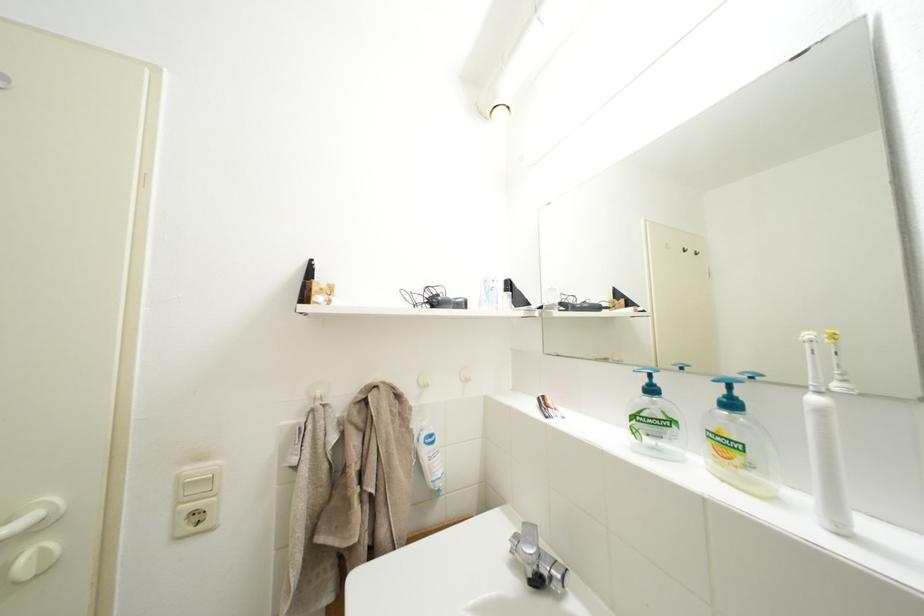
Image resolution: width=924 pixels, height=616 pixels. Find the location of `electric toothbrush`. electric toothbrush is located at coordinates (823, 447).